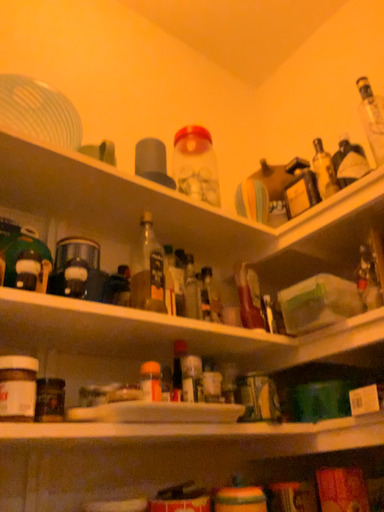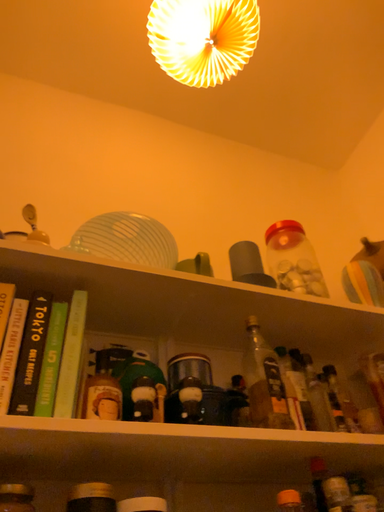
Question: How did the camera likely rotate when shooting the video?

Choices:
 (A) rotated downward
 (B) rotated upward

Answer: (B)